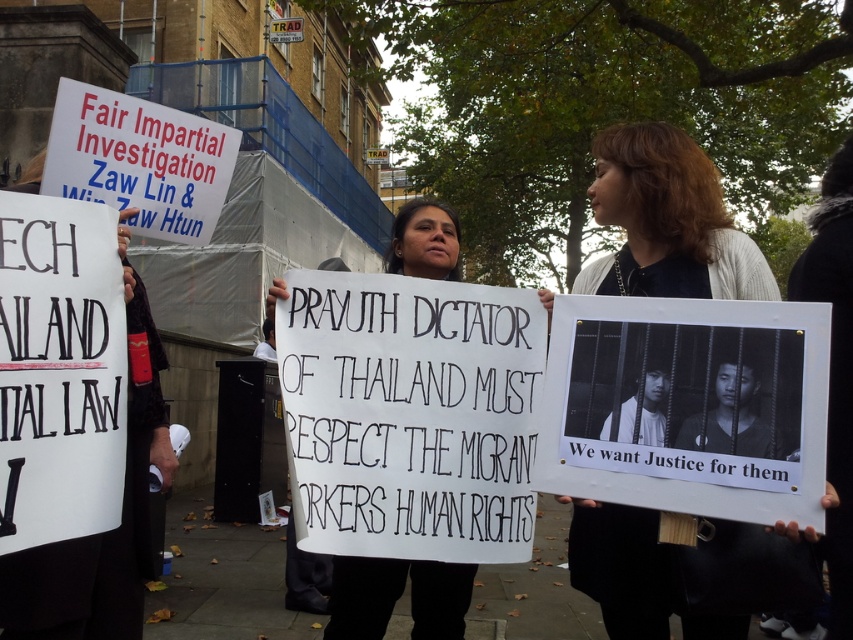
Question: Which point is farther to the camera?

Choices:
 (A) (467, 572)
 (B) (666, 150)

Answer: (A)

Question: Does matte white cardigan at center appear on the right side of white paper sign at center?

Choices:
 (A) yes
 (B) no

Answer: (A)

Question: Can you confirm if matte white cardigan at center is positioned above white paper sign at center?

Choices:
 (A) no
 (B) yes

Answer: (B)

Question: Which point is farther from the camera taking this photo?

Choices:
 (A) (424, 563)
 (B) (614, 513)

Answer: (A)

Question: Is matte white cardigan at center smaller than white paper sign at center?

Choices:
 (A) no
 (B) yes

Answer: (B)

Question: Among these points, which one is nearest to the camera?

Choices:
 (A) (447, 241)
 (B) (585, 284)

Answer: (B)